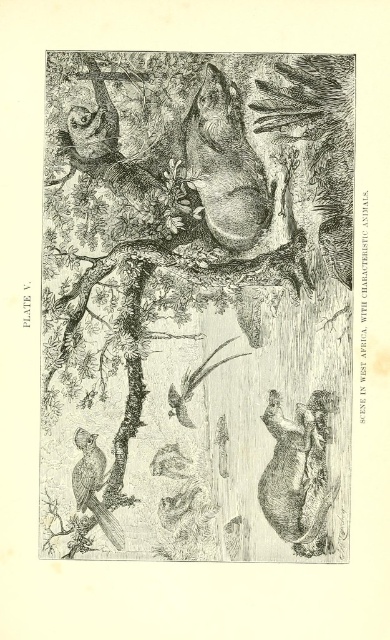
In the image labeled PLATE V, there is a black ink drawing of tree at center and a brown fur bear at center. Which object is placed higher in the image?

The black ink drawing of tree at center is positioned higher than the brown fur bear at center in the image.

You are an explorer in West Africa and see the brown fur bear at center and the brown textured bird at lower left. Which animal is located to the right of the other?

The brown fur bear at center is positioned on the right side of brown textured bird at lower left.

You are an art student analyzing this black and white illustration. You need to determine the spatial relationship between the black ink drawing of tree at center and the brown textured bird at lower left. Based on the scene description, which object is positioned to the right of the other?

The black ink drawing of tree at center is to the right of brown textured bird at lower left.